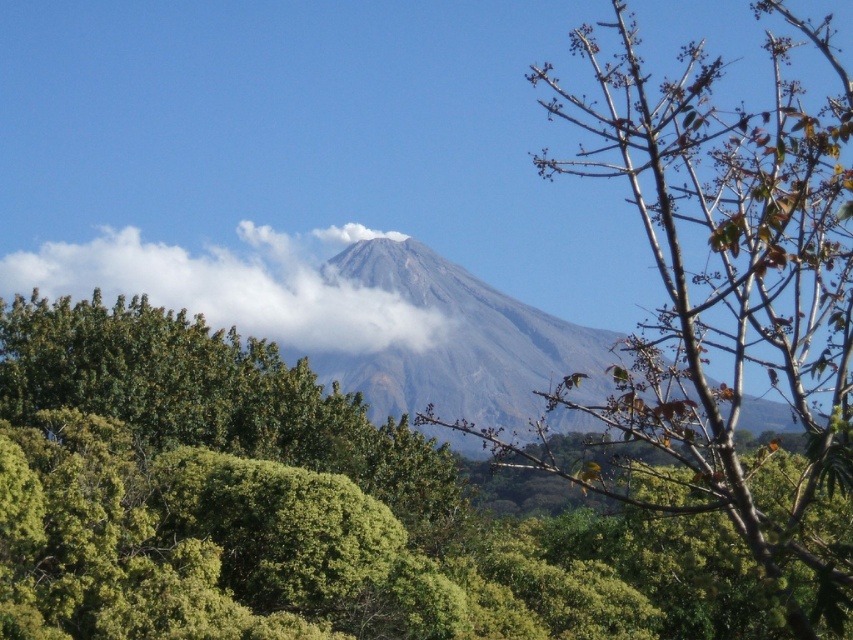
You are standing at the base of the volcano and looking up. Which object is higher up in the scene between the green leafy tree at center and the white fluffy cloud at upper center?

The white fluffy cloud at upper center is higher up in the scene than the green leafy tree at center.

You are standing at the base of the volcano and want to reach the summit. There is a green leafy tree at center in your path. Based on its position, can you estimate how far you are from the summit?

The green leafy tree at center is positioned at point (294, 508), which suggests it is closer to the base of the volcano. Therefore, you are still some distance away from the summit and need to continue climbing.

You are a hiker standing at the base of the volcano. You see the green leafy tree at center and the white fluffy cloud at upper center. Which object is closer to you?

The green leafy tree at center is closer to you since it is much taller than the white fluffy cloud at upper center, implying it is positioned lower in the scene.